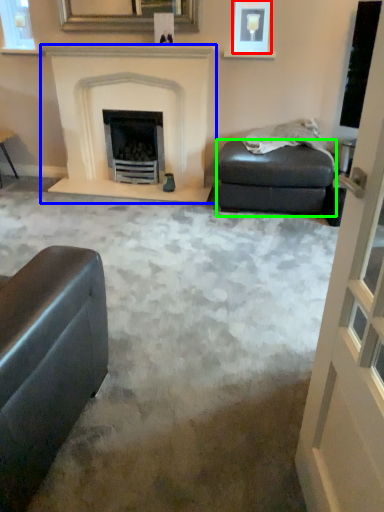
Question: Considering the real-world distances, which object is farthest from picture frame (highlighted by a red box)? fireplace (highlighted by a blue box) or footrest (highlighted by a green box)?

Choices:
 (A) fireplace
 (B) footrest

Answer: (B)